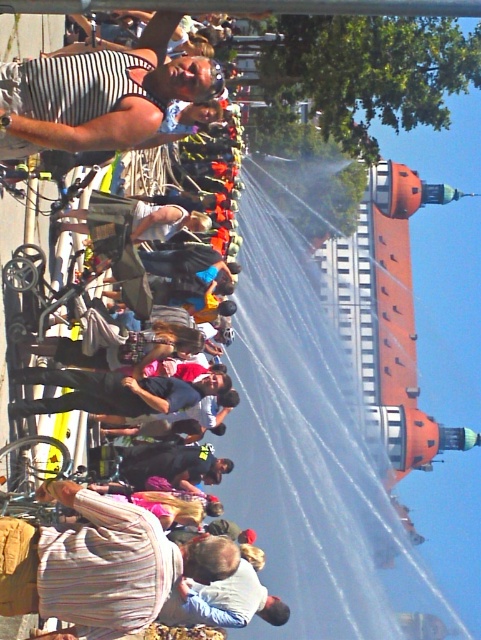
You are a photographer trying to capture a detailed shot of both the striped fabric shirt at lower left and the striped fabric tank top at upper left. Since you want to ensure both are clearly visible, which clothing item requires a wider focus area due to its size?

The striped fabric shirt at lower left requires a wider focus area because its width surpasses that of the striped fabric tank top at upper left.

In the image of the outdoor fountain gathering, where is the striped fabric shirt at lower left located in terms of coordinates?

The striped fabric shirt at lower left is located at point (101, 564).